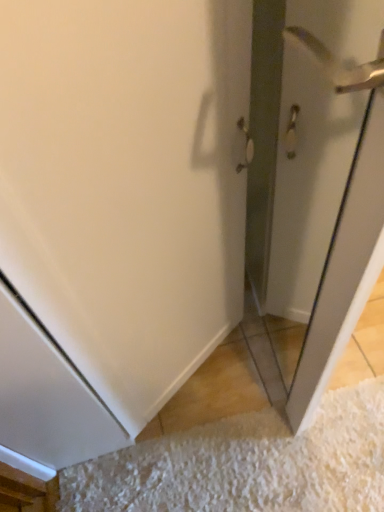
Question: Looking at their shapes, would you say polished silver door handle at upper right is wider or thinner than white textured doormat at lower right?

Choices:
 (A) thin
 (B) wide

Answer: (B)

Question: Considering the positions of polished silver door handle at upper right and white textured doormat at lower right in the image, is polished silver door handle at upper right bigger or smaller than white textured doormat at lower right?

Choices:
 (A) small
 (B) big

Answer: (B)

Question: Estimate the real-world distances between objects in this image. Which object is closer to the clear glass screen door at right?

Choices:
 (A) white textured doormat at lower right
 (B) polished silver door handle at upper right

Answer: (B)

Question: Considering the real-world distances, which object is closest to the clear glass screen door at right?

Choices:
 (A) white textured doormat at lower right
 (B) polished silver door handle at upper right

Answer: (B)